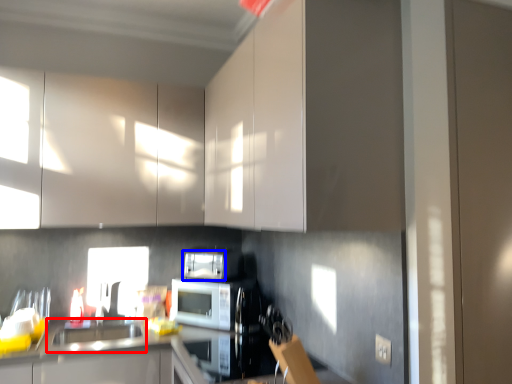
Question: Which object is closer to the camera taking this photo, sink (highlighted by a red box) or appliance (highlighted by a blue box)?

Choices:
 (A) sink
 (B) appliance

Answer: (A)